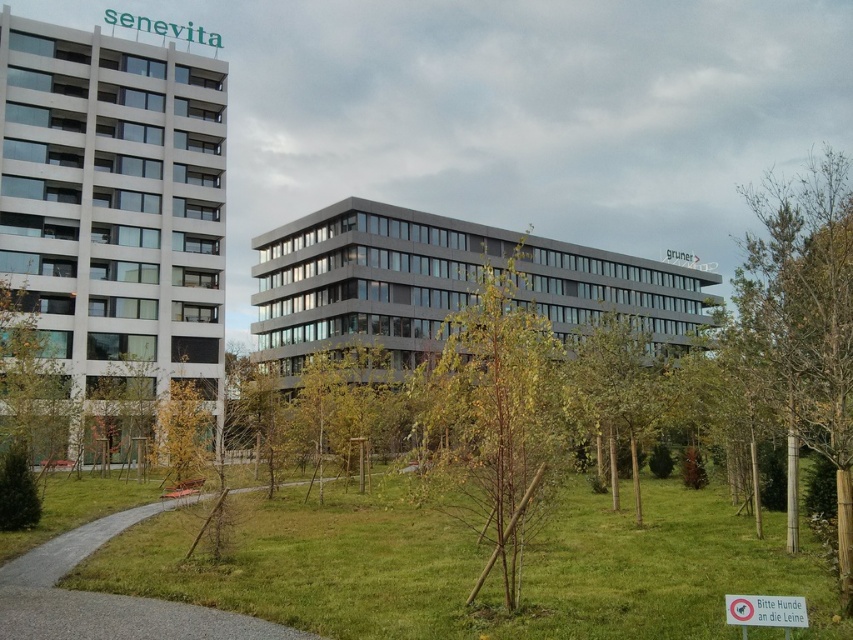
Question: Is brown wood tree at center thinner than green leafy tree at center?

Choices:
 (A) no
 (B) yes

Answer: (A)

Question: Which point appears closest to the camera in this image?

Choices:
 (A) (582, 541)
 (B) (583, 355)
 (C) (503, 445)

Answer: (C)

Question: Does brown wood tree at center have a greater width compared to green leafy tree at center?

Choices:
 (A) no
 (B) yes

Answer: (B)

Question: Does brown wood tree at center have a larger size compared to green leafy tree at center?

Choices:
 (A) no
 (B) yes

Answer: (B)

Question: Which point appears farthest from the camera in this image?

Choices:
 (A) (616, 604)
 (B) (473, 339)

Answer: (B)

Question: Estimate the real-world distances between objects in this image. Which object is closer to the green leafy tree at center?

Choices:
 (A) green grassy at lower left
 (B) brown wood tree at center

Answer: (A)